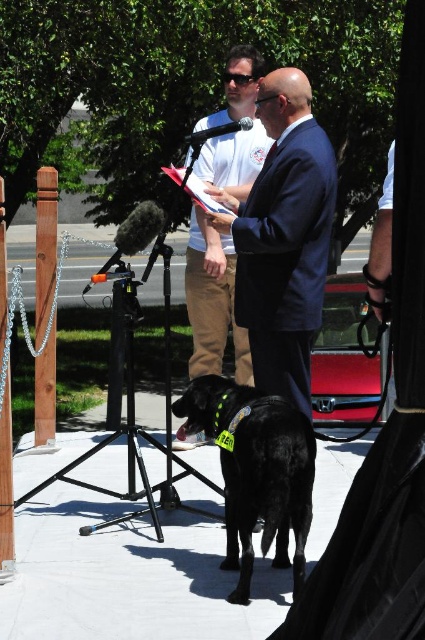
Question: Does black matte dog at center appear under white cotton shirt at center?

Choices:
 (A) yes
 (B) no

Answer: (A)

Question: Which of the following is the closest to the observer?

Choices:
 (A) dark blue suit at center
 (B) black matte dog at center

Answer: (B)

Question: Among these objects, which one is nearest to the camera?

Choices:
 (A) black matte dog at center
 (B) white cotton shirt at center
 (C) dark blue suit at center

Answer: (A)

Question: Observing the image, what is the correct spatial positioning of black matte dog at center in reference to white cotton shirt at center?

Choices:
 (A) above
 (B) below

Answer: (B)

Question: Can you confirm if dark blue suit at center is positioned to the left of black matte dog at center?

Choices:
 (A) yes
 (B) no

Answer: (B)

Question: Which point appears closest to the camera in this image?

Choices:
 (A) (303, 99)
 (B) (221, 292)
 (C) (311, 499)

Answer: (C)